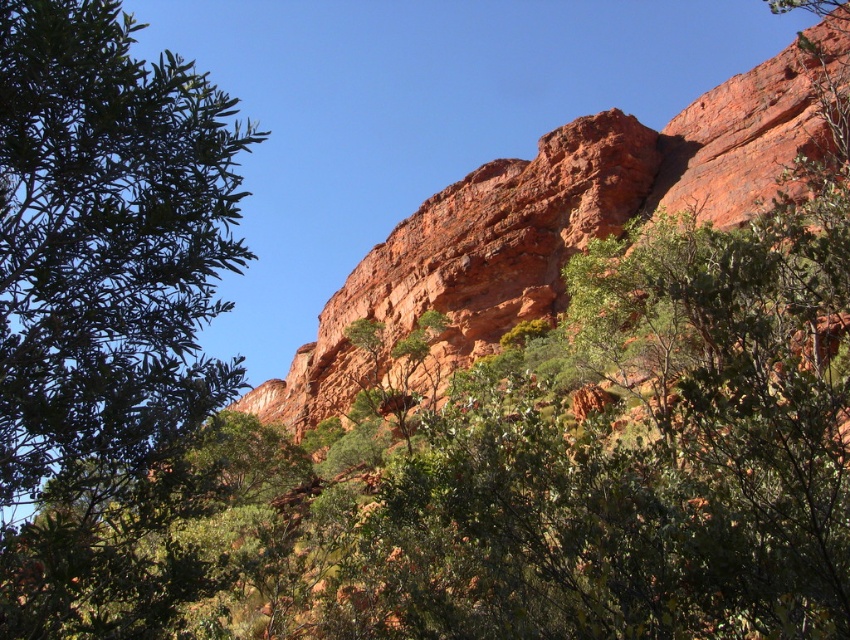
You are standing in front of the large reddish brown rock formation and notice two points marked on the rock surface. The points are labeled as point 1 at coordinates (3, 332) and point 2 at coordinates (258, 413). Which point is closer to you?

Point 1 at coordinates (3, 332) is closer to the viewer than point 2 at coordinates (258, 413).